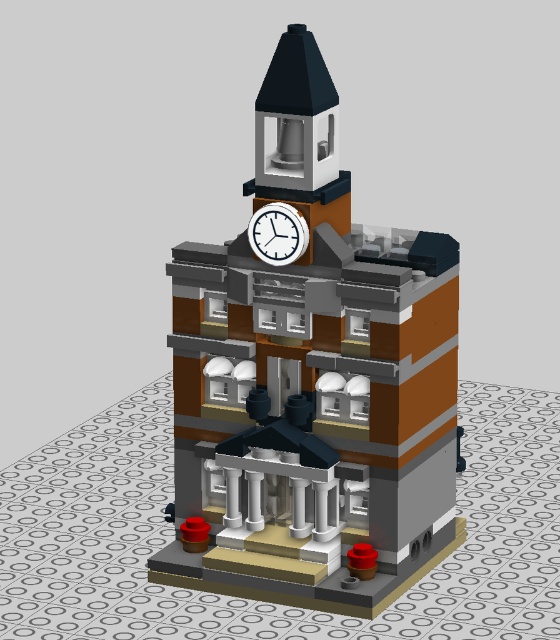
You are an architect designing a miniature model of this town hall. The white plastic clock at upper center needs to be placed on top of the brick tower at center. Will the clock fit on the tower without overhanging the edges?

The brick tower at center has a larger size compared to the white plastic clock at upper center, so the clock will fit on the tower without overhanging the edges since the tower is bigger in size.

You are standing in front of the LEGO town hall building. You notice two points marked on the base section of the building. The first point is at coordinates point (407, 401) and the second is at point (294, 234). Which of these points is closer to your viewpoint?

Point (294, 234) is closer to your viewpoint because it is less further to the camera compared to point (407, 401), which is stated to be further away.

You are an architect reviewing the LEGO town hall model. You notice the brick tower at center and the white plastic clock at upper center. Based on their positions, which object is located to the left of the other?

The white plastic clock at upper center is to the left of the brick tower at center because the brick tower at center is positioned to the right of the white plastic clock at upper center.